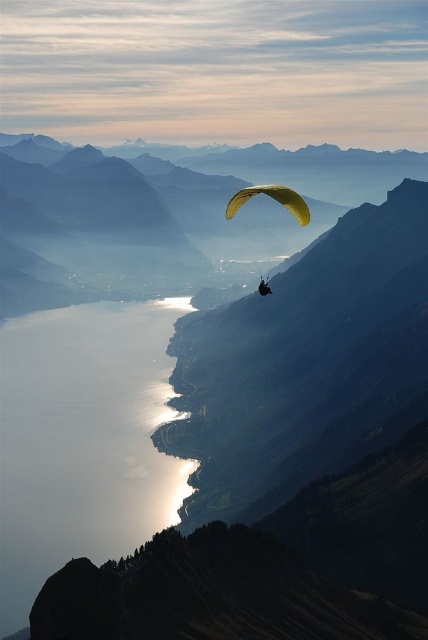
Question: Which of these objects is positioned closest to the yellow fabric parachute at center?

Choices:
 (A) silvery reflective water at lower left
 (B) matte yellow paraglider at center

Answer: (B)

Question: Which object appears farthest from the camera in this image?

Choices:
 (A) silvery reflective water at lower left
 (B) matte yellow paraglider at center

Answer: (A)

Question: Is yellow fabric parachute at center thinner than matte yellow paraglider at center?

Choices:
 (A) no
 (B) yes

Answer: (A)

Question: Does silvery reflective water at lower left appear over matte yellow paraglider at center?

Choices:
 (A) no
 (B) yes

Answer: (A)

Question: Which object is closer to the camera taking this photo?

Choices:
 (A) yellow fabric parachute at center
 (B) silvery reflective water at lower left
 (C) matte yellow paraglider at center

Answer: (C)

Question: Can you confirm if silvery reflective water at lower left is bigger than yellow fabric parachute at center?

Choices:
 (A) yes
 (B) no

Answer: (A)